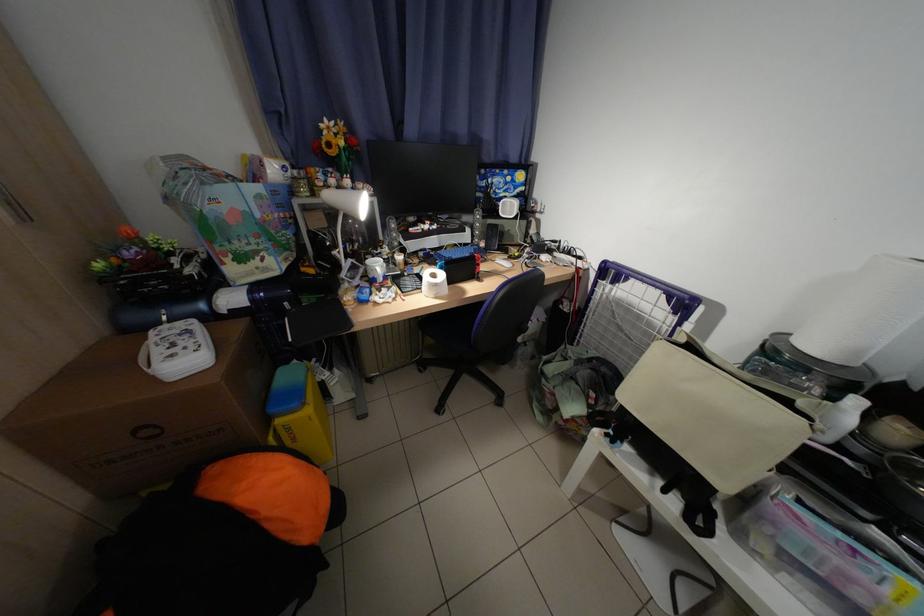
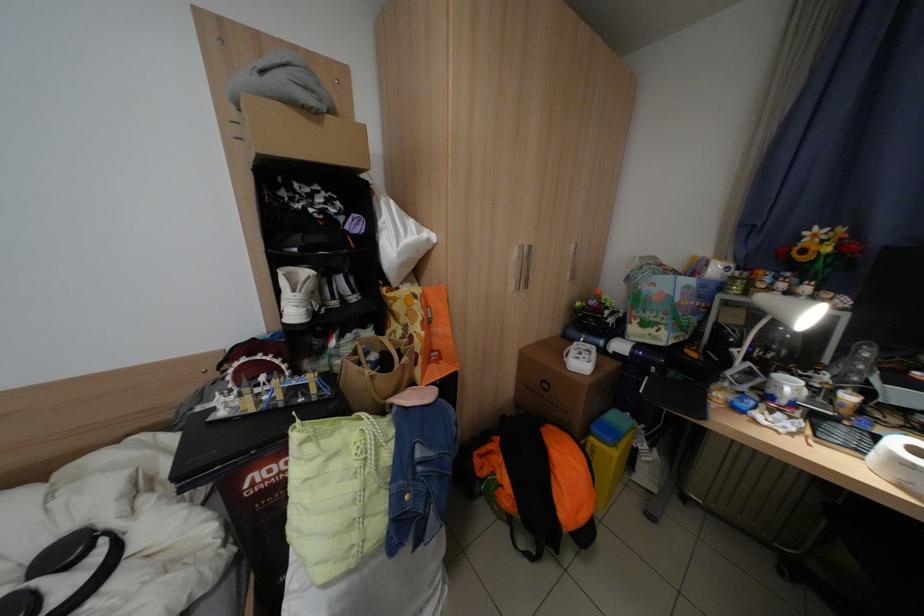
Where in the second image is the point corresponding to pixel 388 267 from the first image?

(800, 387)